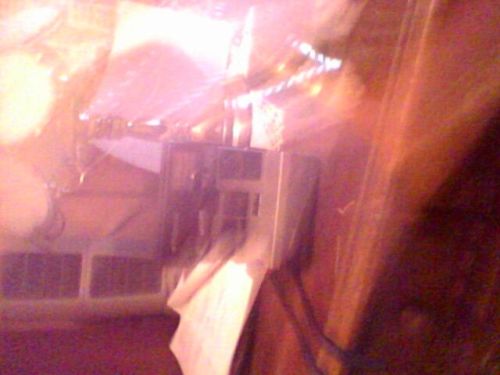
This screenshot has width=500, height=375. Identify the location of lampshade. (19, 116).